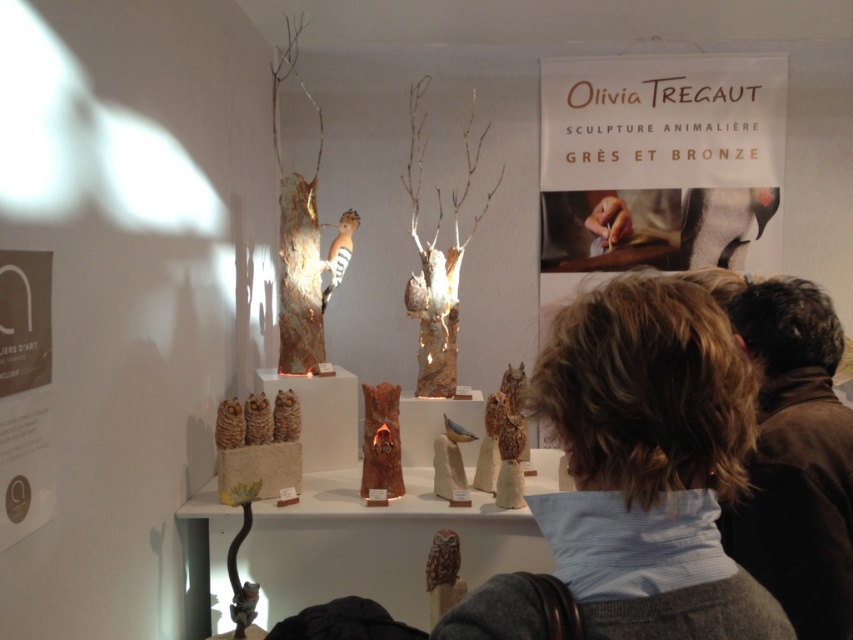
Question: Does brown fuzzy jacket at upper right have a larger size compared to matte brown sign at left?

Choices:
 (A) no
 (B) yes

Answer: (B)

Question: Which point is closer to the camera?

Choices:
 (A) (393, 480)
 (B) (44, 381)
 (C) (625, 515)
 (D) (828, 346)

Answer: (C)

Question: Which point is farther to the camera?

Choices:
 (A) (392, 433)
 (B) (668, 147)
 (C) (807, 554)

Answer: (B)

Question: Can you confirm if matte brown sign at left is positioned to the right of matte brown wood owl at center?

Choices:
 (A) no
 (B) yes

Answer: (A)

Question: Does matte brown wood owl at center appear on the left side of brown matte owl at center?

Choices:
 (A) yes
 (B) no

Answer: (B)

Question: Among these points, which one is nearest to the camera?

Choices:
 (A) (552, 336)
 (B) (683, 124)

Answer: (A)